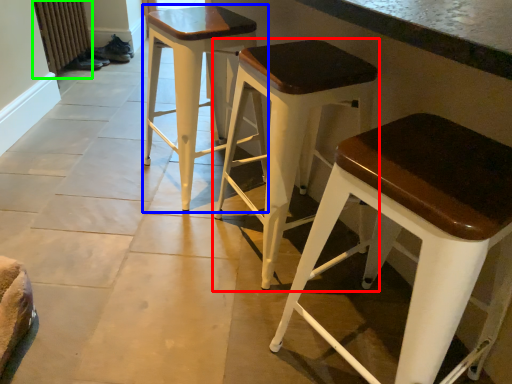
Question: Considering the real-world distances, which object is closest to stool (highlighted by a red box)? stool (highlighted by a blue box) or radiator (highlighted by a green box).

Choices:
 (A) stool
 (B) radiator

Answer: (A)